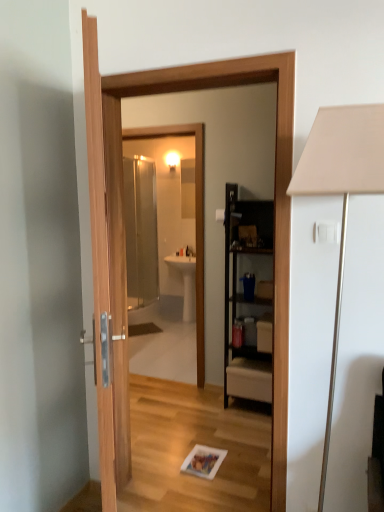
Where is `free point behind wooden door at center`? This screenshot has height=512, width=384. free point behind wooden door at center is located at coordinates (208, 445).